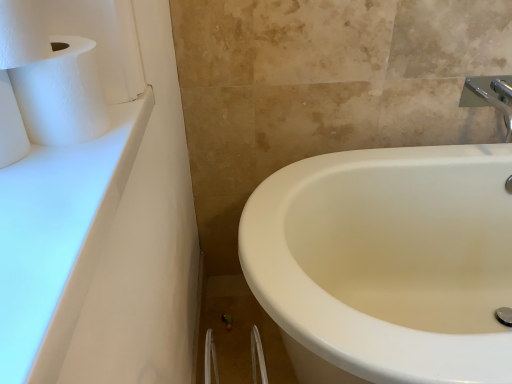
Locate an element on the screen. The height and width of the screenshot is (384, 512). vacant region above white glossy countertop at upper left (from a real-world perspective) is located at coordinates (58, 177).